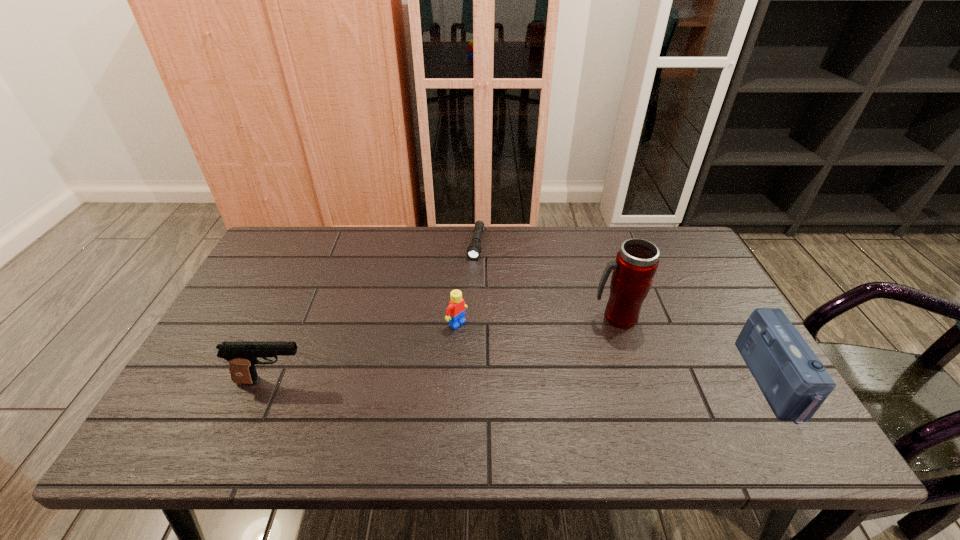
Identify the location of pistol. (242, 356).

Find the location of a particular element. This screenshot has width=960, height=540. camera is located at coordinates (795, 383).

Locate an element on the screen. flashlight is located at coordinates (474, 249).

Identify the location of the shortest object. (474, 249).

Locate an element on the screen. Image resolution: width=960 pixels, height=540 pixels. Lego is located at coordinates (455, 312).

Where is `thermos bottle`? thermos bottle is located at coordinates (636, 263).

Identify the location of the fourth object from left to right. The height and width of the screenshot is (540, 960). (636, 263).

Identify the location of free space located 0.370m at the barrel of the leftmost object. This screenshot has height=540, width=960. (464, 381).

Find the location of a particular element. This screenshot has width=960, height=540. free region located 0.250m at the lens end of the shortest object is located at coordinates (464, 318).

You are a GUI agent. You are given a task and a screenshot of the screen. Output one action in this format:
    pyautogui.click(x=<x>, y=<y>)
    Task: Click on the free space located at the lens end of the shortest object
    This screenshot has height=540, width=960.
    Given the screenshot: What is the action you would take?
    pyautogui.click(x=462, y=323)